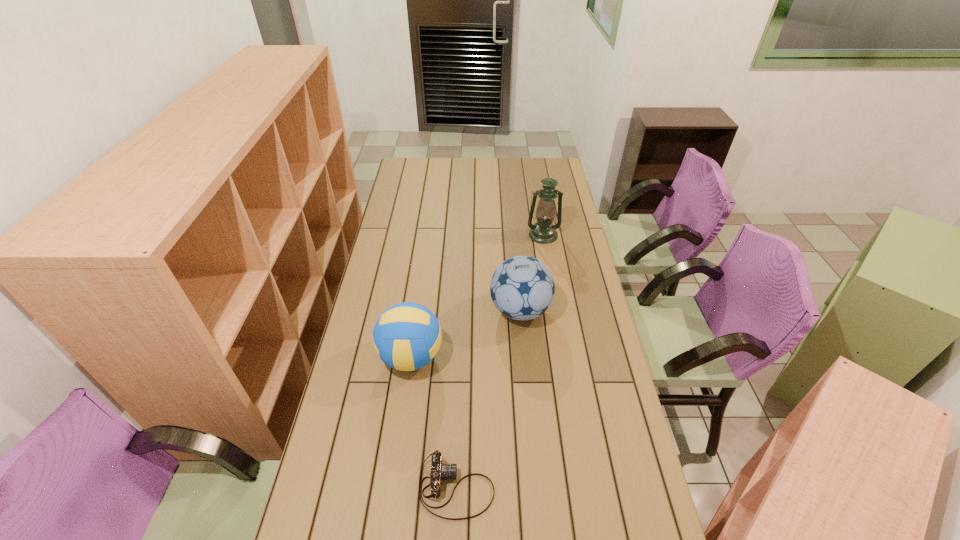
The width and height of the screenshot is (960, 540). Identify the location of vacant space located on the back of the volleyball. (424, 261).

At what (x,y) coordinates should I click in order to perform the action: click on vacant space located 0.130m on the front-facing side of the shortest object. Please return your answer as a coordinate pair (x, y). The width and height of the screenshot is (960, 540). Looking at the image, I should click on (542, 487).

Locate an element on the screen. The height and width of the screenshot is (540, 960). object that is at the left edge is located at coordinates (407, 336).

The width and height of the screenshot is (960, 540). Find the location of `object that is positioned at the right edge`. object that is positioned at the right edge is located at coordinates (543, 231).

Identify the location of free space at the far edge of the desktop. Image resolution: width=960 pixels, height=540 pixels. (503, 180).

I want to click on blank area at the left edge, so click(356, 374).

Identify the location of vacant space at the right edge of the desktop. (586, 300).

Find the location of `vacant point at the far left corner`. vacant point at the far left corner is located at coordinates (424, 173).

Identify the location of free space at the far right corner of the desktop. The image size is (960, 540). (539, 173).

Where is `vacant region between the tallest object and the volleyball`? vacant region between the tallest object and the volleyball is located at coordinates (477, 296).